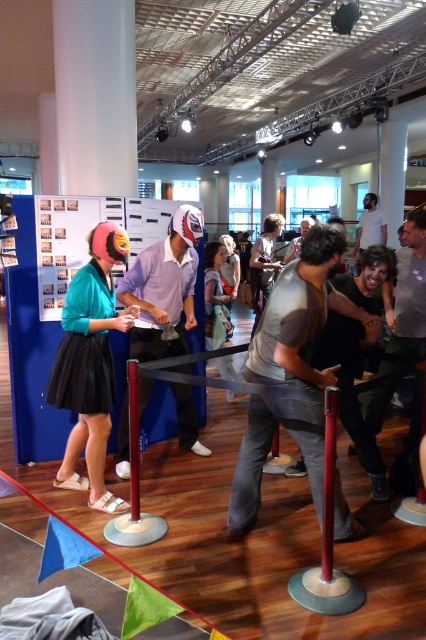
You are a photographer trying to capture a photo of the matte purple shirt at center and the white glossy pillar at upper center. From your current position, which object is located to the right?

The white glossy pillar at upper center is located to the right of the matte purple shirt at center.

You are standing in the event space and want to find the exact location of the point at coordinates (290,371). According to the scene description, where would this point be located?

The point at coordinates (290,371) is on the matte gray t shirt at center.

You are planning to place a 1.5 meter wide banner between the matte purple shirt at center and the white glossy pillar at upper center. Will there be enough space for the banner?

The distance between the matte purple shirt at center and the white glossy pillar at upper center is 7.35 meters. Since the banner is only 1.5 meters wide, there is ample space to place it between them.